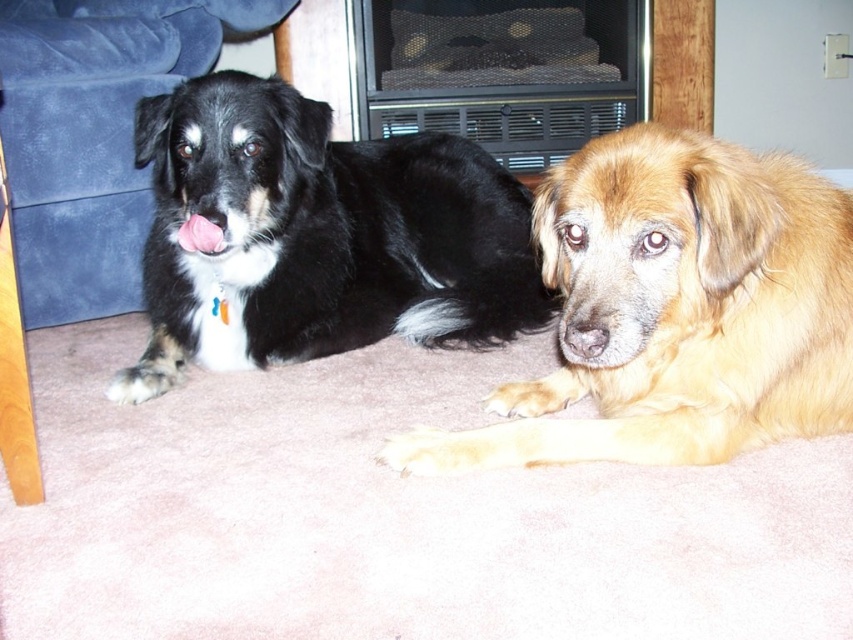
You are a photographer setting up a tripod in front of the two dogs. You want to take a photo where both dogs are in focus. Since the golden fur dog at center is closer to you, will you need to adjust the focus to ensure the black soft fur dog at left is also in focus?

The golden fur dog at center is closer to the viewer than the black soft fur dog at left. To ensure both are in focus, you should adjust the focus to a point between them or use a smaller aperture for a greater depth of field.

You are a dog owner trying to decide where to place a new dog bed. You see the black soft fur dog at left and the suede couch at left in the room. Which object is lower in height?

The black soft fur dog at left is shorter than the suede couch at left, so the black soft fur dog at left is lower in height.

You are a dog trainer observing the scene. The golden fur dog at center and the suede couch at left are in your view. Based on their positions, which object is closer to the floor?

The golden fur dog at center is closer to the floor because it is positioned below the suede couch at left.